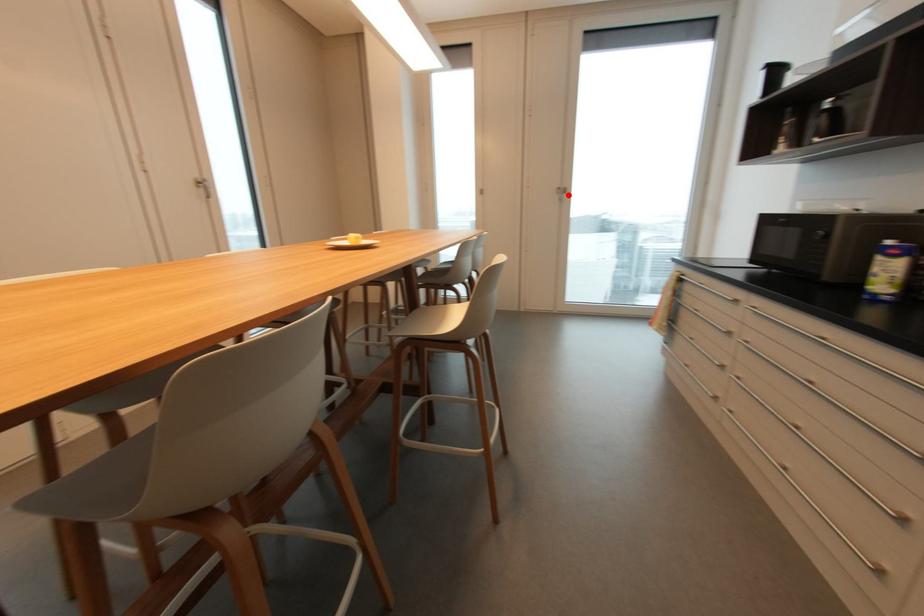
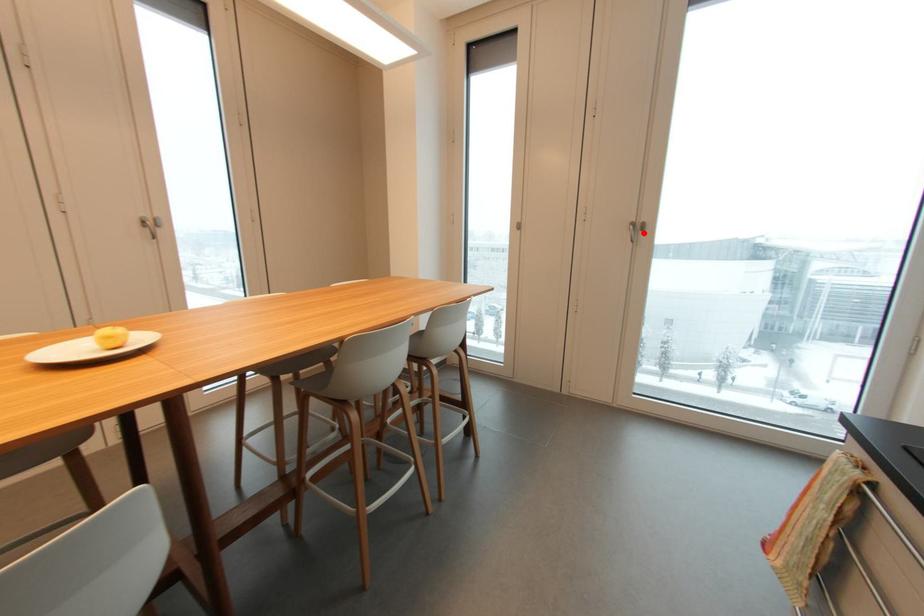
I am providing you with two images of the same scene from different viewpoints. A red point is marked on the first image and another point is marked on the second image. Is the marked point in image1 the same physical position as the marked point in image2?

Yes